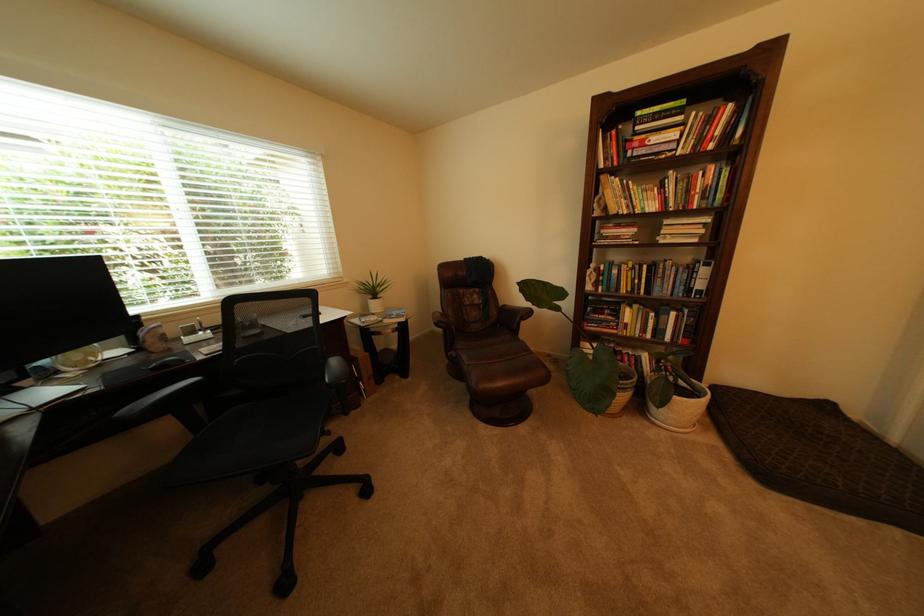
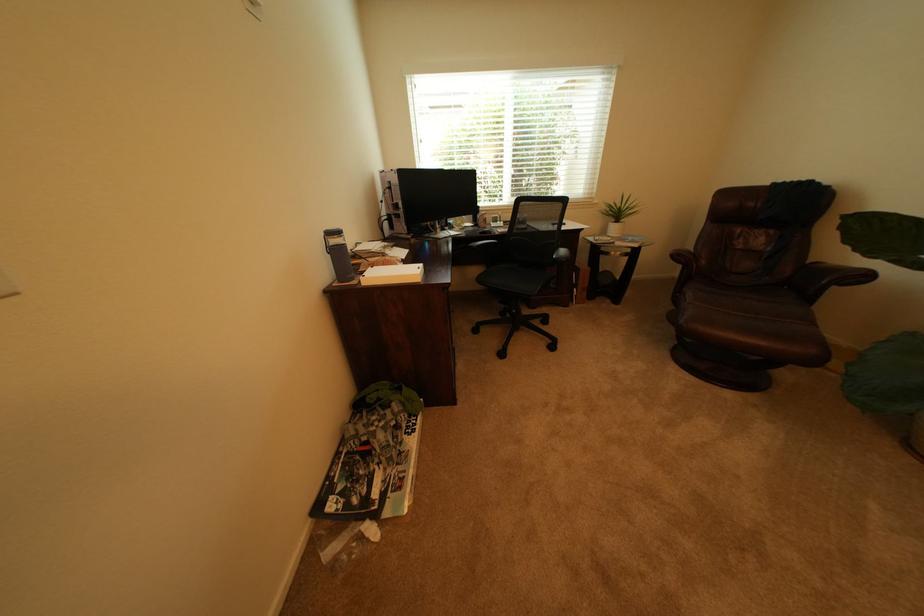
Locate, in the second image, the point that corresponds to (x=140, y=355) in the first image.

(482, 228)